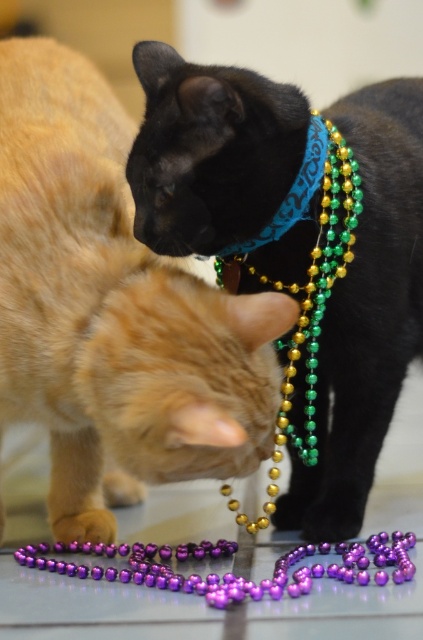
Is shiny black cat at center in front of green metallic beads at center?

Yes, shiny black cat at center is in front of green metallic beads at center.

In the scene shown: Can you confirm if shiny black cat at center is positioned above green metallic beads at center?

Yes.

Between point (104, 83) and point (291, 440), which one is positioned in front?

Point (291, 440) is more forward.

Where is `shiny black cat at center`? The height and width of the screenshot is (640, 423). shiny black cat at center is located at coordinates (x=112, y=310).

Is point (228, 109) closer to viewer compared to point (324, 224)?

Yes, point (228, 109) is closer to viewer.

Measure the distance between black matte bandana at upper center and camera.

A distance of 1.02 meters exists between black matte bandana at upper center and camera.

Where is `black matte bandana at upper center`? black matte bandana at upper center is located at coordinates (365, 314).

Image resolution: width=423 pixels, height=640 pixels. What are the coordinates of `black matte bandana at upper center` in the screenshot? It's located at (365, 314).

Which is in front, point (285, 291) or point (277, 218)?

Positioned in front is point (277, 218).

Is green metallic beads at center shorter than blue fabric neckband at upper center?

In fact, green metallic beads at center may be taller than blue fabric neckband at upper center.

Image resolution: width=423 pixels, height=640 pixels. I want to click on green metallic beads at center, so click(308, 296).

The image size is (423, 640). Identify the location of green metallic beads at center. (308, 296).